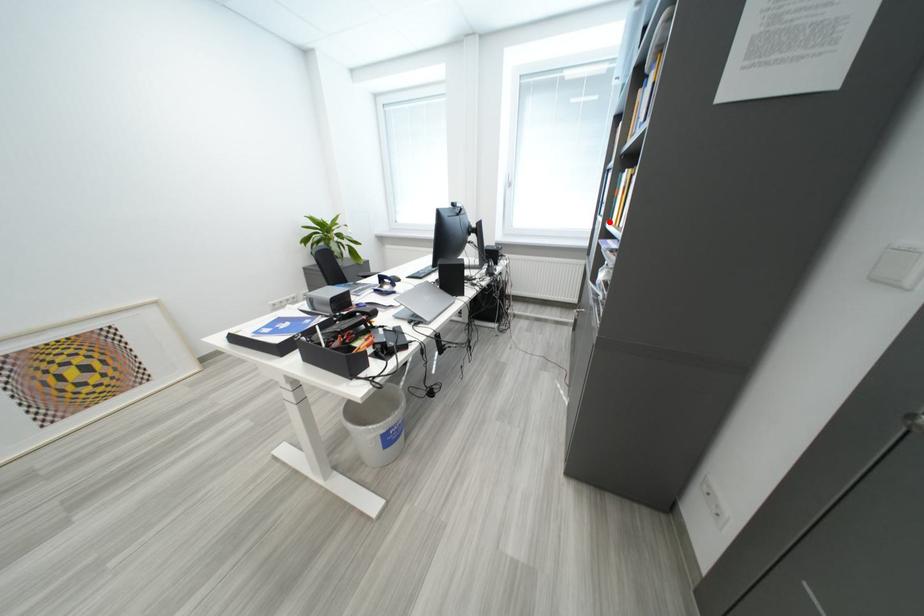
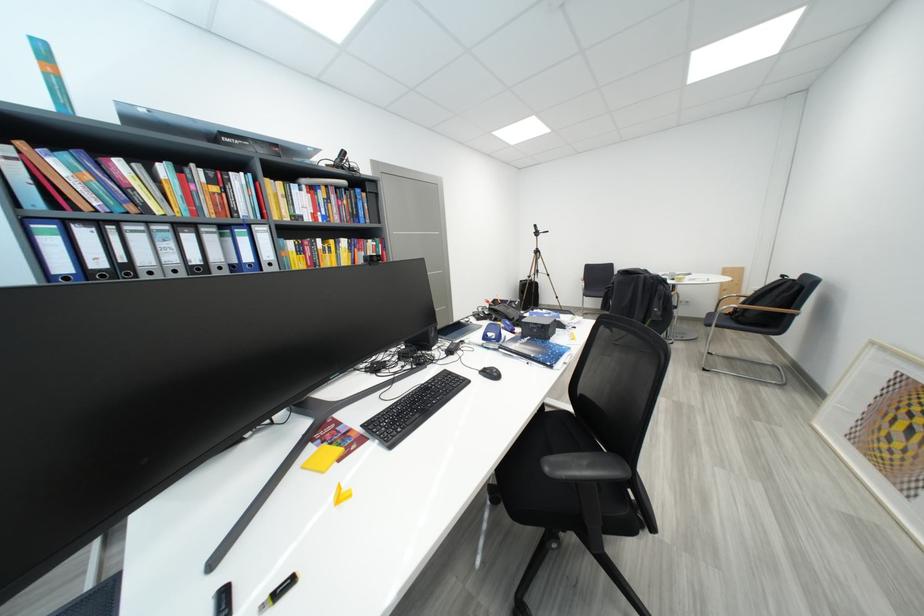
Question: I am providing you with two images of the same scene from different viewpoints. A red point is marked on the first image. Can you still see the location of the red point in image 2?

Choices:
 (A) Yes
 (B) No

Answer: (B)